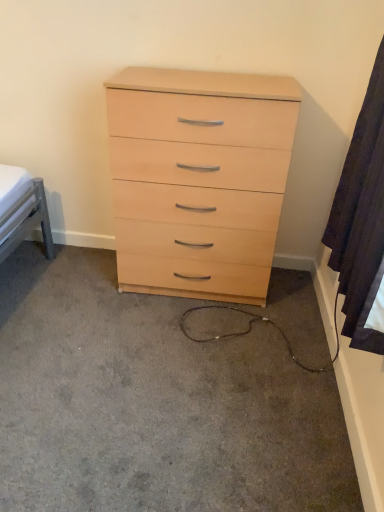
Question: Can you confirm if dark fabric curtain at right is shorter than light wood dresser at center?

Choices:
 (A) no
 (B) yes

Answer: (A)

Question: Could you tell me if dark fabric curtain at right is facing light wood dresser at center?

Choices:
 (A) yes
 (B) no

Answer: (B)

Question: Is dark fabric curtain at right next to light wood dresser at center?

Choices:
 (A) yes
 (B) no

Answer: (B)

Question: Can you confirm if dark fabric curtain at right is wider than light wood dresser at center?

Choices:
 (A) no
 (B) yes

Answer: (A)

Question: Would you say dark fabric curtain at right is outside light wood dresser at center?

Choices:
 (A) no
 (B) yes

Answer: (B)

Question: Does dark fabric curtain at right have a larger size compared to light wood dresser at center?

Choices:
 (A) yes
 (B) no

Answer: (B)

Question: Is dark fabric curtain at right wider than light wood/veneer chest of drawers at center?

Choices:
 (A) no
 (B) yes

Answer: (A)

Question: From the image's perspective, is dark fabric curtain at right above light wood/veneer chest of drawers at center?

Choices:
 (A) yes
 (B) no

Answer: (B)

Question: Is dark fabric curtain at right to the left of light wood/veneer chest of drawers at center from the viewer's perspective?

Choices:
 (A) yes
 (B) no

Answer: (B)

Question: Considering the relative sizes of dark fabric curtain at right and light wood/veneer chest of drawers at center in the image provided, is dark fabric curtain at right smaller than light wood/veneer chest of drawers at center?

Choices:
 (A) yes
 (B) no

Answer: (A)

Question: Could light wood/veneer chest of drawers at center be considered to be inside dark fabric curtain at right?

Choices:
 (A) no
 (B) yes

Answer: (A)

Question: Is dark fabric curtain at right further to camera compared to light wood/veneer chest of drawers at center?

Choices:
 (A) no
 (B) yes

Answer: (A)

Question: Is light wood dresser at center oriented away from dark fabric curtain at right?

Choices:
 (A) no
 (B) yes

Answer: (A)